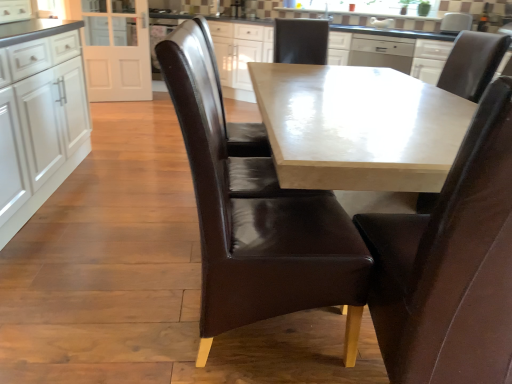
The image size is (512, 384). Identify the location of free space between brown leather chair at center, acting as the 3th chair starting from the right, and white glossy cabinets at left, which is the 1th cabinetry in front-to-back order. (106, 251).